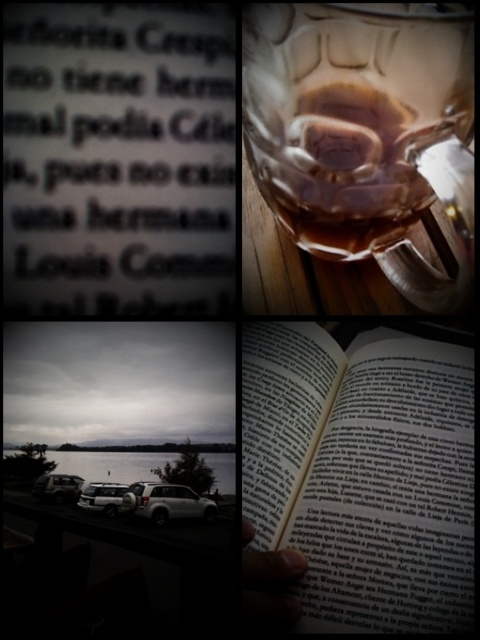
You are standing in front of the image and want to touch the black paper book at upper left and the white matte car at lower left. Which object will your hand reach first?

The black paper book at upper left is closer to the viewer than the white matte car at lower left, so your hand will reach the black paper book at upper left first.

You are an interior designer planning to place a black paper book at upper left and a white matte car at lower left on a shelf. Which object should you place first to ensure stability?

The black paper book at upper left is much taller than the white matte car at lower left. To ensure stability, place the taller object first so it can support the others.